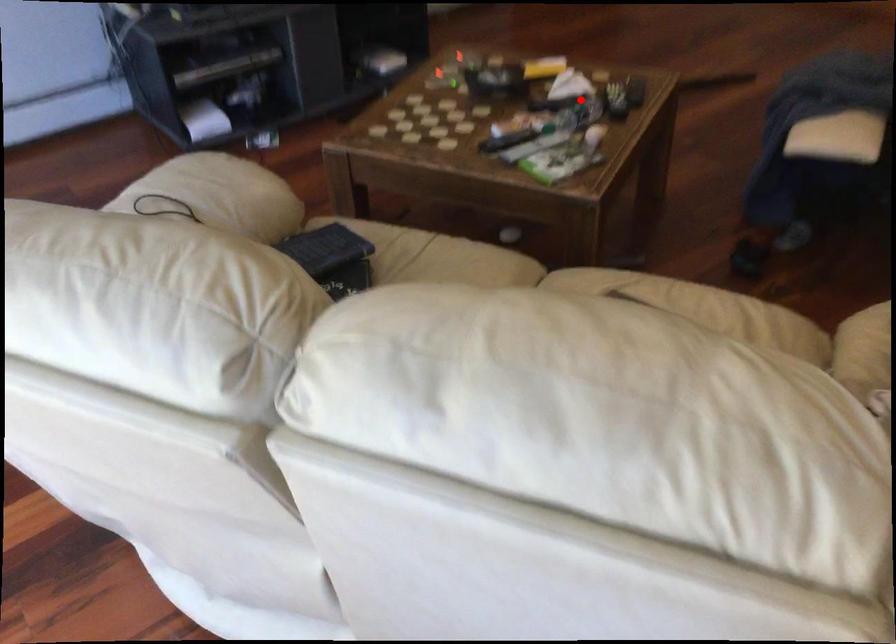
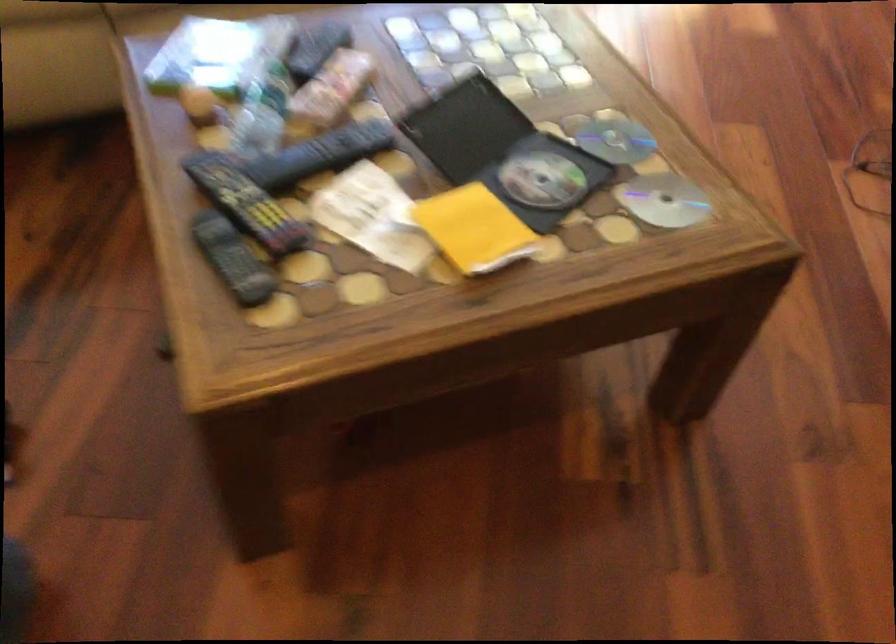
Locate, in the second image, the point that corresponds to the highlighted location in the first image.

(262, 113)